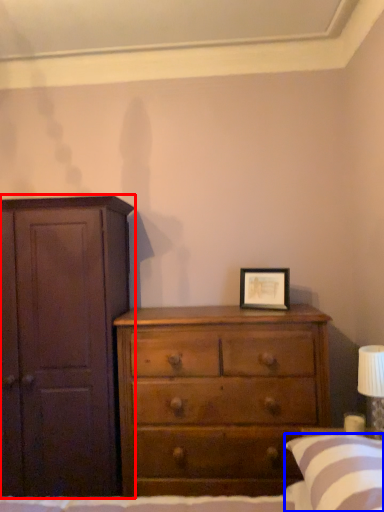
Question: Which object is further to the camera taking this photo, cupboard (highlighted by a red box) or pillow (highlighted by a blue box)?

Choices:
 (A) cupboard
 (B) pillow

Answer: (A)